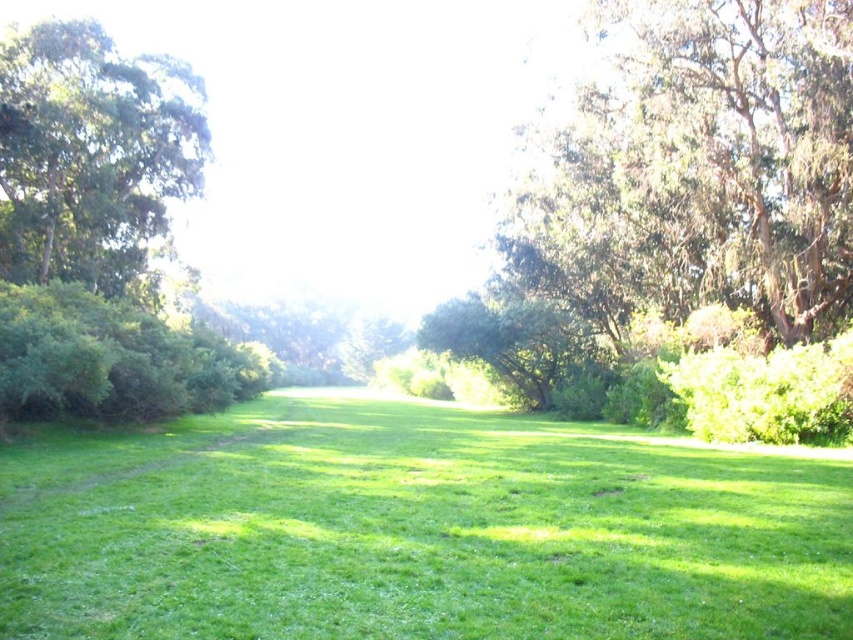
Between green grassy field at center and green leafy tree at left, which one appears on the right side from the viewer's perspective?

From the viewer's perspective, green grassy field at center appears more on the right side.

Who is taller, green grassy field at center or green leafy tree at left?

green leafy tree at left

Describe the element at coordinates (418, 531) in the screenshot. I see `green grassy field at center` at that location.

This screenshot has height=640, width=853. Identify the location of green grassy field at center. (418, 531).

Does green leafy tree at upper right appear on the left side of green leafy tree at left?

Incorrect, green leafy tree at upper right is not on the left side of green leafy tree at left.

Locate an element on the screen. green leafy tree at upper right is located at coordinates (701, 168).

This screenshot has width=853, height=640. I want to click on green leafy tree at upper right, so click(x=701, y=168).

Which of these two, green grassy field at center or green leafy tree at upper right, stands taller?

With more height is green leafy tree at upper right.

Is green grassy field at center below green leafy tree at upper right?

Yes.

Where is `green grassy field at center`? green grassy field at center is located at coordinates (418, 531).

The width and height of the screenshot is (853, 640). In order to click on green grassy field at center in this screenshot , I will do `click(418, 531)`.